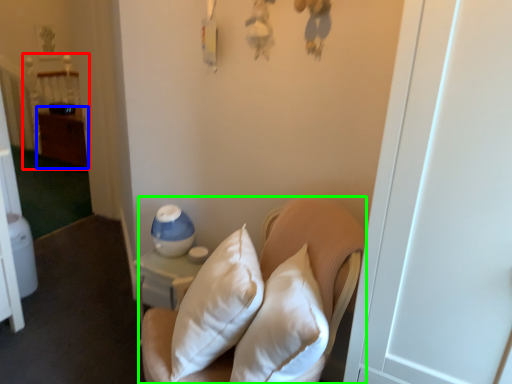
Question: Considering the real-world distances, which object is farthest from bed (highlighted by a red box)? dresser (highlighted by a blue box) or furniture (highlighted by a green box)?

Choices:
 (A) dresser
 (B) furniture

Answer: (B)